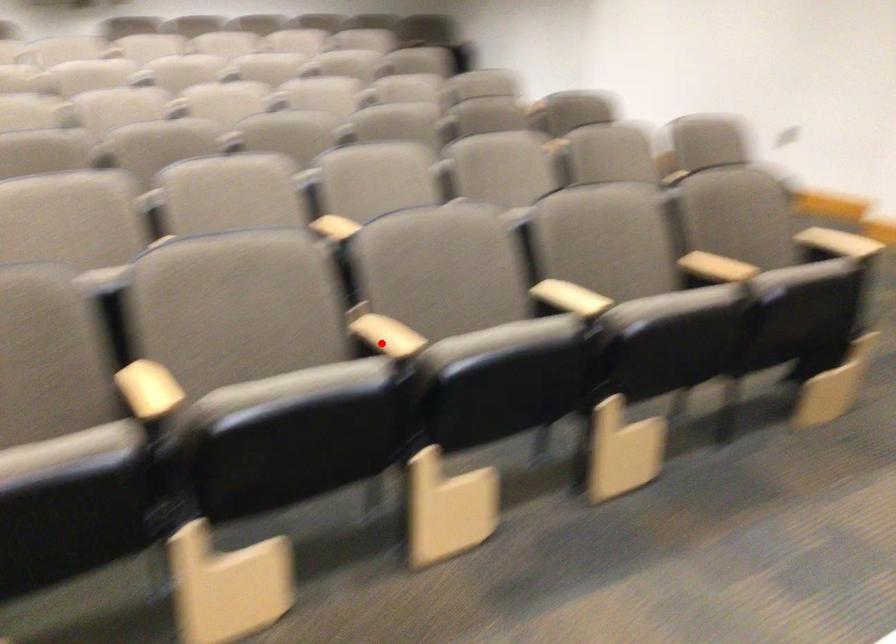
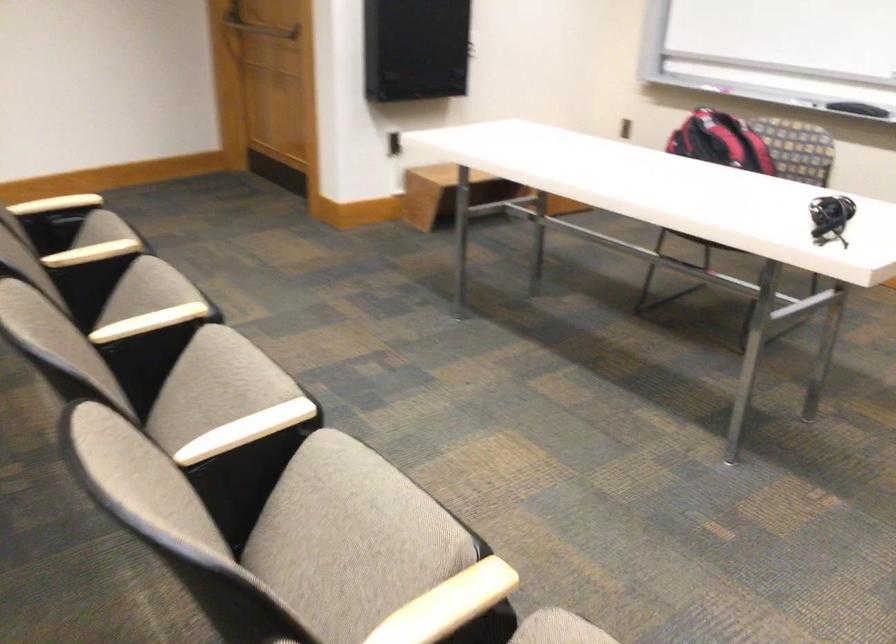
Question: I am providing you with two images of the same scene from different viewpoints. A red point is shown in image1. For the corresponding object point in image2, is it positioned nearer or farther from the camera?

Choices:
 (A) Nearer
 (B) Farther

Answer: (A)